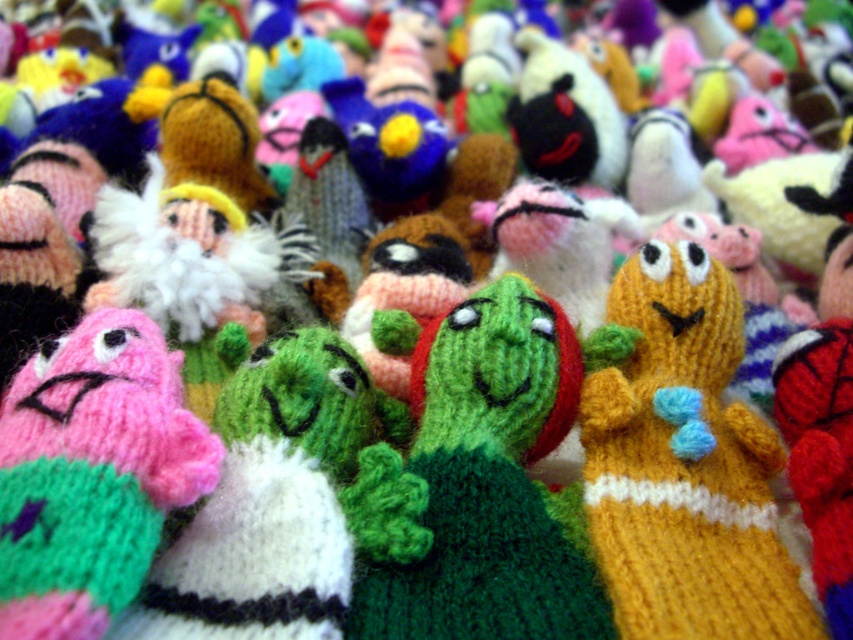
Consider the image. You are examining a group of finger puppets displayed on a table. You notice two specific points labeled as point (520, 356) and point (753, 492). If you were to reach out to touch them, which point would require you to extend your hand further away from your body?

Point (753, 492) requires you to extend your hand further away from your body because it is farther from the viewer compared to point (520, 356).